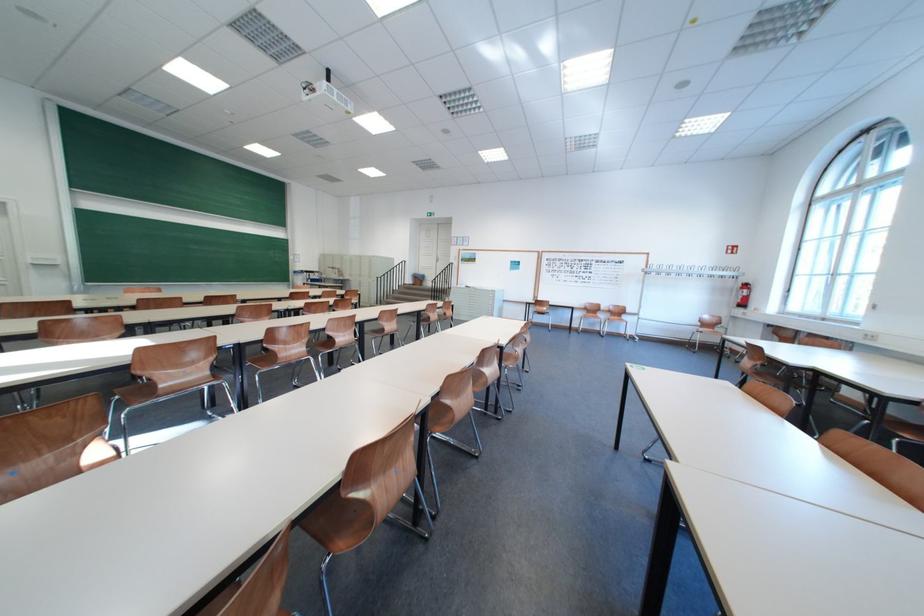
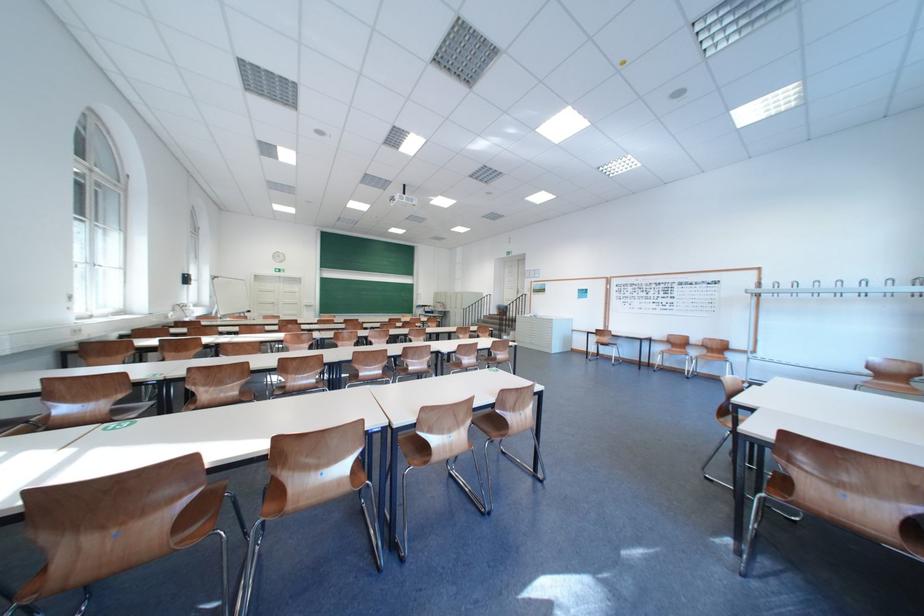
Where in the second image is the point corresponding to (x=591, y=315) from the first image?

(673, 350)